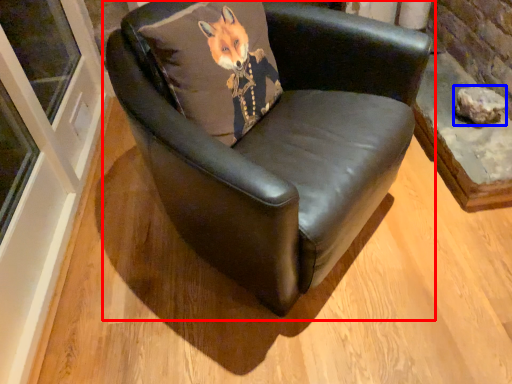
Question: Among these objects, which one is nearest to the camera, chair (highlighted by a red box) or stone (highlighted by a blue box)?

Choices:
 (A) chair
 (B) stone

Answer: (A)